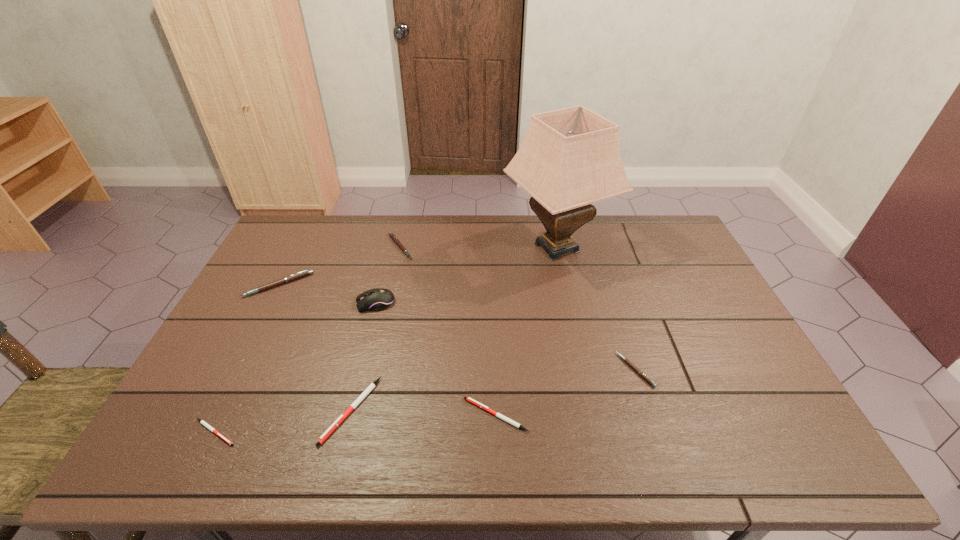
Where is `free space at the near edge of the desktop`? This screenshot has height=540, width=960. free space at the near edge of the desktop is located at coordinates (504, 431).

Image resolution: width=960 pixels, height=540 pixels. Find the location of `vacant position at the left edge of the desktop`. vacant position at the left edge of the desktop is located at coordinates (292, 291).

This screenshot has height=540, width=960. Identify the location of free space at the near right corner of the desktop. (783, 465).

Where is `free spot between the biggest white pen and the lampshade`? This screenshot has width=960, height=540. free spot between the biggest white pen and the lampshade is located at coordinates (454, 329).

This screenshot has height=540, width=960. In order to click on vacant space that's between the second tallest object and the second smallest pink pen in this screenshot , I will do `click(388, 275)`.

The width and height of the screenshot is (960, 540). What are the coordinates of `free point between the leftmost pink pen and the rightmost pink pen` in the screenshot? It's located at (457, 327).

Image resolution: width=960 pixels, height=540 pixels. I want to click on vacant area that lies between the lampshade and the farthest pink pen, so click(478, 247).

I want to click on unoccupied area between the leftmost white pen and the rightmost pink pen, so click(425, 401).

Identify the location of vacant area that lies between the lampshade and the nearest pink pen. (596, 309).

Where is `free space between the farthest pink pen and the tallest object`? The width and height of the screenshot is (960, 540). free space between the farthest pink pen and the tallest object is located at coordinates (478, 247).